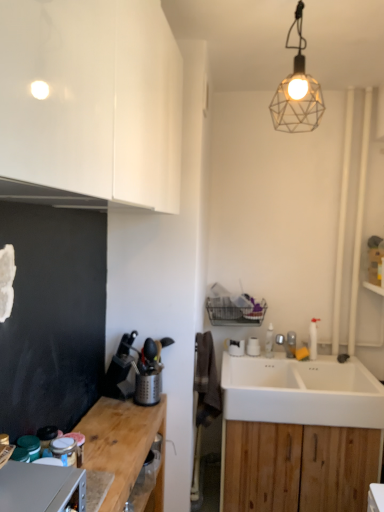
Image resolution: width=384 pixels, height=512 pixels. Identify the location of blank space above wooden at left (from a real-world perspective). (111, 435).